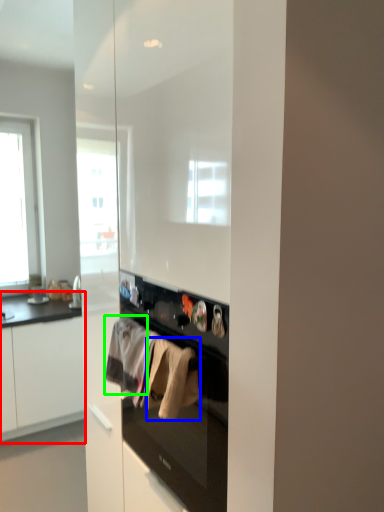
Question: Estimate the real-world distances between objects in this image. Which object is farther from cabinetry (highlighted by a red box), clothing (highlighted by a blue box) or clothing (highlighted by a green box)?

Choices:
 (A) clothing
 (B) clothing

Answer: (A)